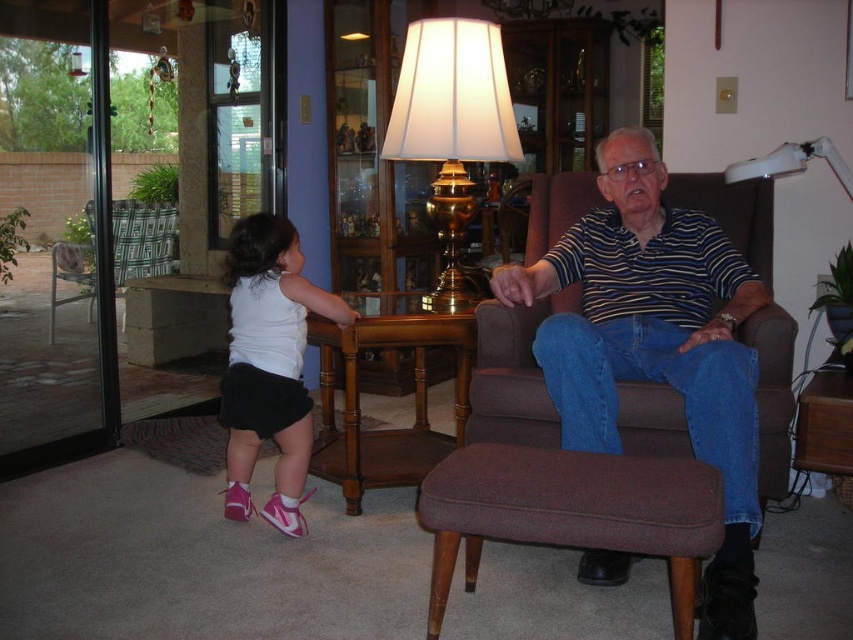
You are moving a large painting that is 1.2 meters wide. You need to place it against a wall. The transparent glass door at left and the gold metallic lamp at center are in the way. Which object should you move to make space?

The transparent glass door at left is bigger than the gold metallic lamp at center, so you should move the gold metallic lamp at center to make space for the painting since it is smaller and easier to relocate.

You are standing in the room and see both the striped cotton shirt at center and the white matte tank top at lower left. Which clothing item is positioned more to the right side of the room?

The striped cotton shirt at center is positioned more to the right side of the room compared to the white matte tank top at lower left.

In the scene shown: You are standing in the room and notice two points marked in the image. Which point is closer to you, point (x=59, y=442) or point (x=454, y=122)?

Point (x=59, y=442) is closer to you than point (x=454, y=122) because it is further to the viewer.